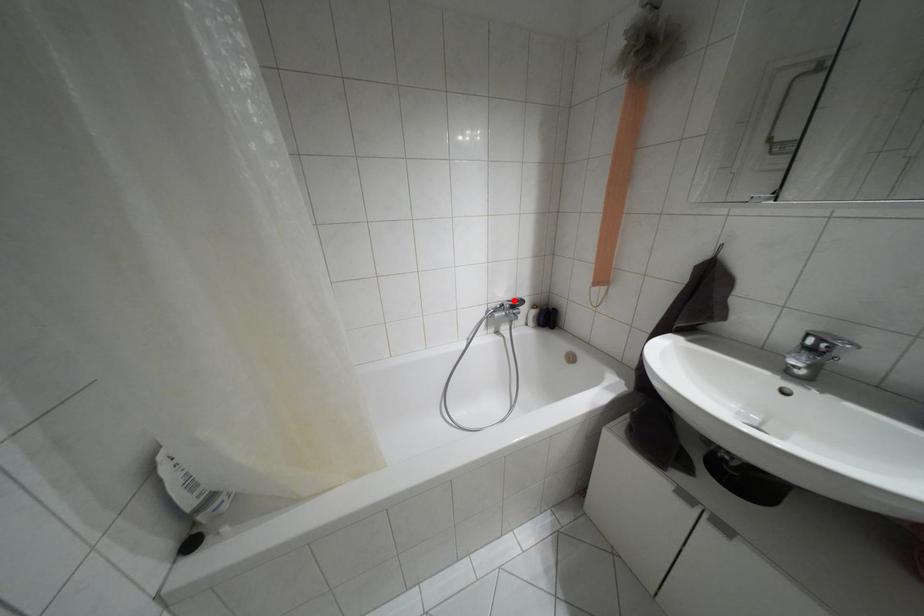
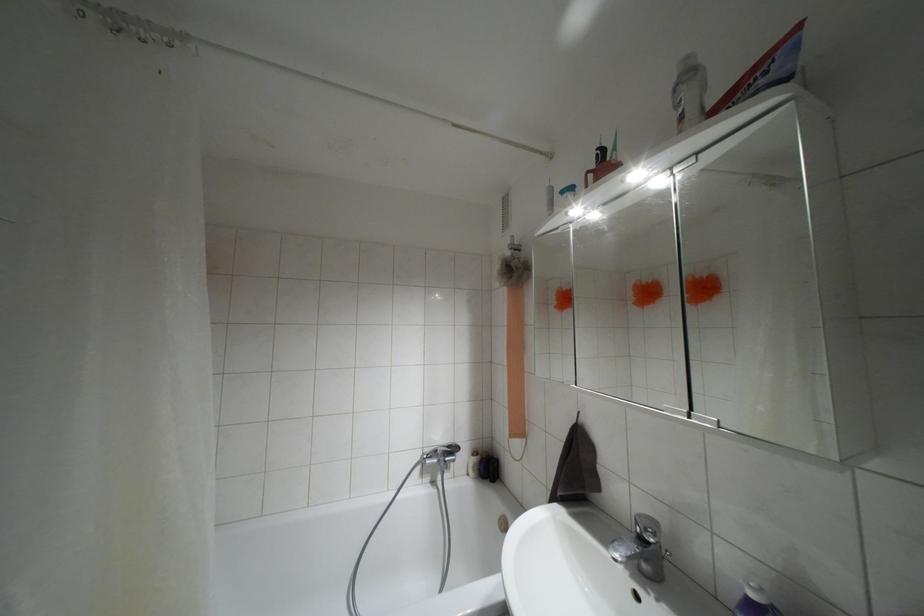
The point at the highlighted location is marked in the first image. Where is the corresponding point in the second image?

(447, 446)